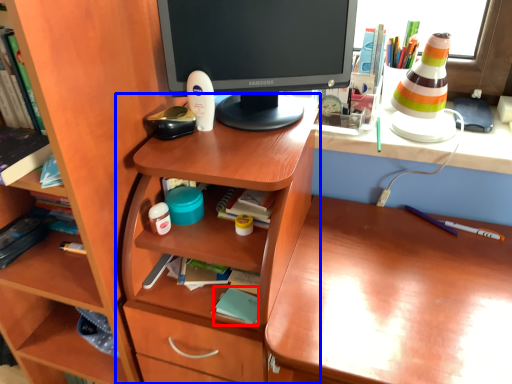
Question: Which of the following is the closest to the observer, book (highlighted by a red box) or table (highlighted by a blue box)?

Choices:
 (A) book
 (B) table

Answer: (B)